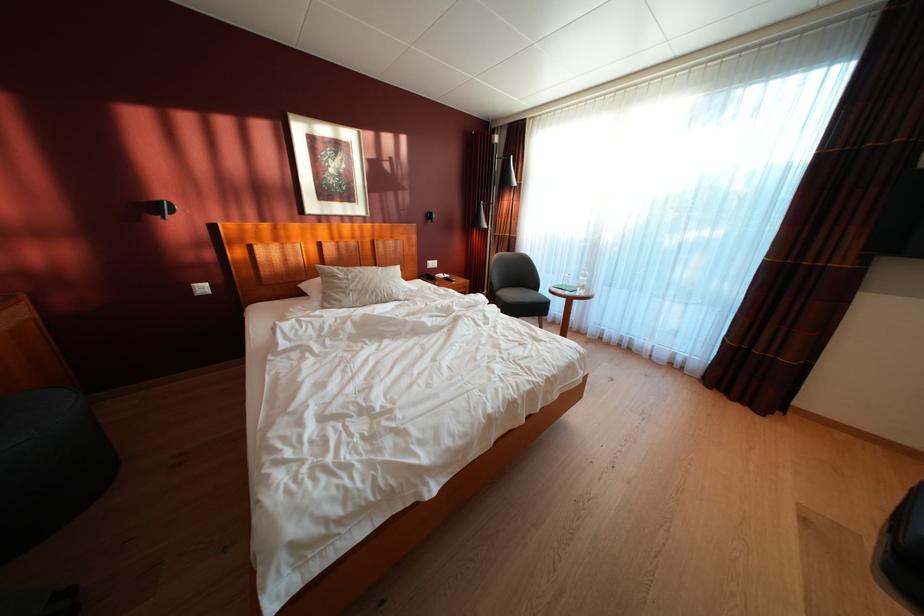
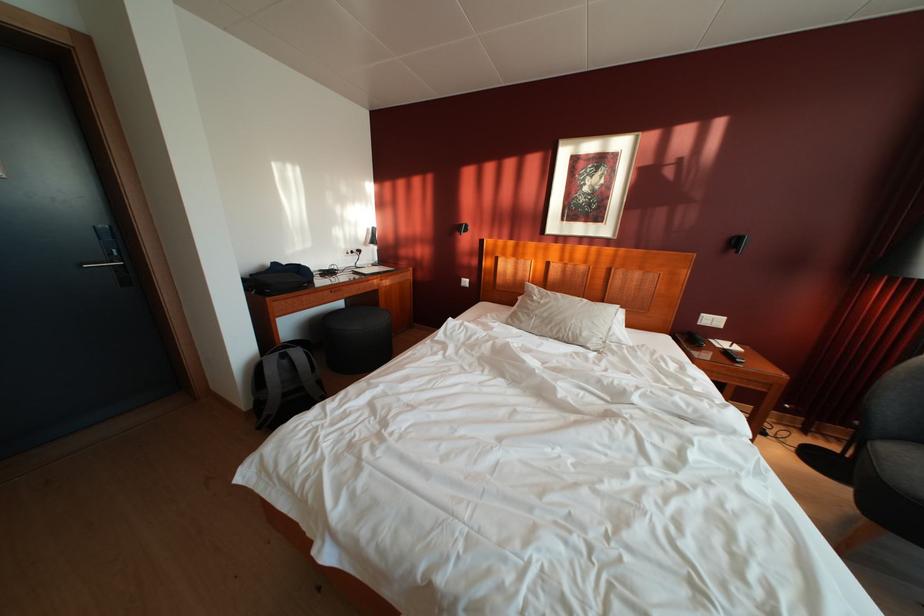
The point at (438, 283) is marked in the first image. Where is the corresponding point in the second image?

(698, 344)